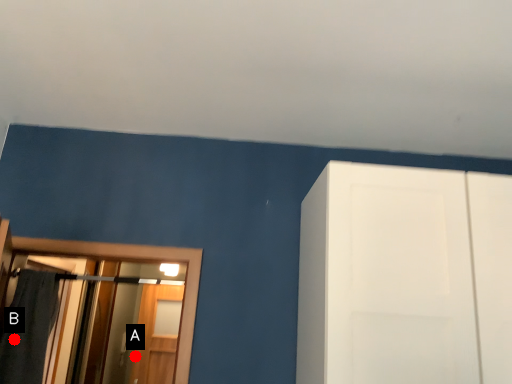
Question: Two points are circled on the image, labeled by A and B beside each circle. Which point is farther from the camera taking this photo?

Choices:
 (A) A is further
 (B) B is further

Answer: (A)